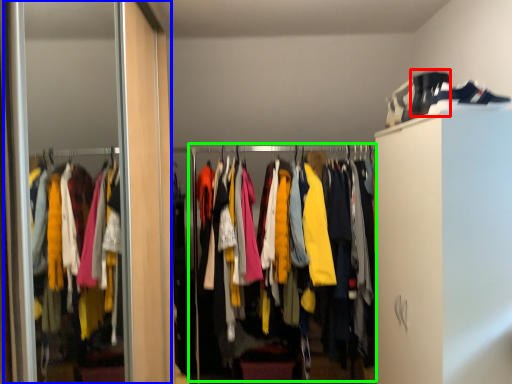
Question: Estimate the real-world distances between objects in this image. Which object is closer to shoe (highlighted by a red box), screen door (highlighted by a blue box) or closet (highlighted by a green box)?

Choices:
 (A) screen door
 (B) closet

Answer: (B)